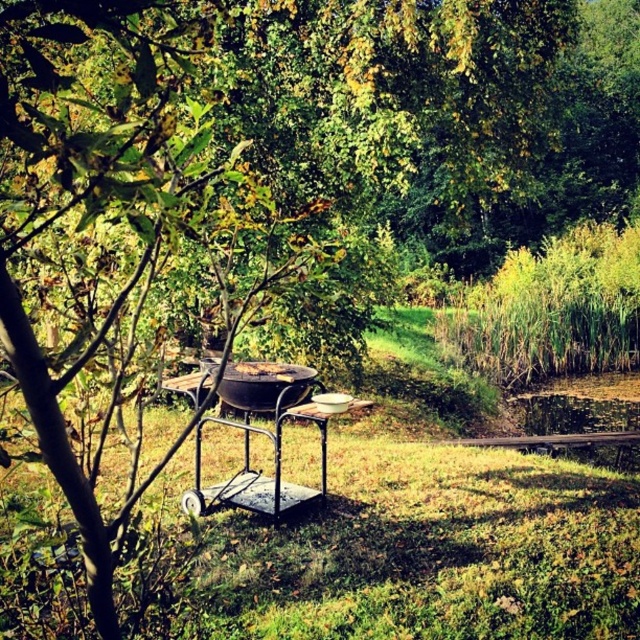
Does point (288, 401) lie in front of point (269, 365)?

Yes, it is.

Which is in front, point (259, 400) or point (250, 369)?

Point (259, 400)

The height and width of the screenshot is (640, 640). I want to click on black matte grill at center, so click(x=262, y=385).

Is metallic grill cart at center smaller than brown matte grill at center?

No, metallic grill cart at center is not smaller than brown matte grill at center.

Is metallic grill cart at center positioned behind brown matte grill at center?

No, it is in front of brown matte grill at center.

The height and width of the screenshot is (640, 640). Describe the element at coordinates (266, 436) in the screenshot. I see `metallic grill cart at center` at that location.

Locate an element on the screen. Image resolution: width=640 pixels, height=640 pixels. metallic grill cart at center is located at coordinates (266, 436).

Can you confirm if metallic grill cart at center is taller than black matte grill at center?

Yes, metallic grill cart at center is taller than black matte grill at center.

Is metallic grill cart at center bigger than black matte grill at center?

Yes, metallic grill cart at center is bigger than black matte grill at center.

Who is more forward, (205,508) or (234,364)?

Point (205,508) is in front.

Locate an element on the screen. The image size is (640, 640). metallic grill cart at center is located at coordinates (266, 436).